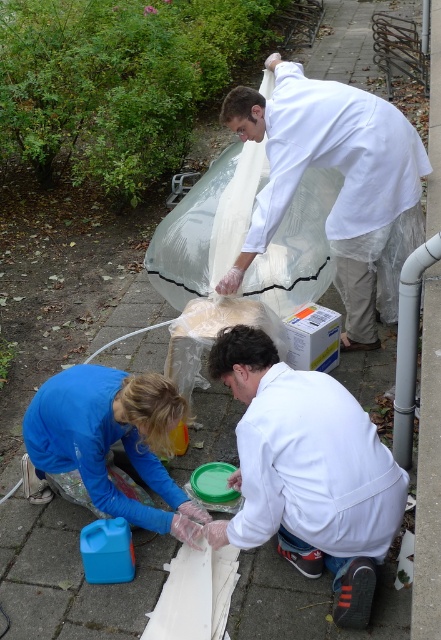
Question: Which of the following is the farthest from the observer?

Choices:
 (A) white matte lab coat at center
 (B) white matte coat at upper center
 (C) blue fabric gloves at lower center

Answer: (B)

Question: Which object is positioned farthest from the white matte coat at upper center?

Choices:
 (A) blue fabric gloves at lower center
 (B) white matte lab coat at center

Answer: (B)

Question: Is white matte coat at upper center to the right of blue fabric gloves at lower center from the viewer's perspective?

Choices:
 (A) yes
 (B) no

Answer: (A)

Question: Can you confirm if white matte lab coat at center is smaller than blue fabric gloves at lower center?

Choices:
 (A) yes
 (B) no

Answer: (B)

Question: Does white matte lab coat at center have a greater width compared to blue fabric gloves at lower center?

Choices:
 (A) no
 (B) yes

Answer: (A)

Question: Considering the real-world distances, which object is closest to the white matte coat at upper center?

Choices:
 (A) white matte lab coat at center
 (B) blue fabric gloves at lower center

Answer: (B)